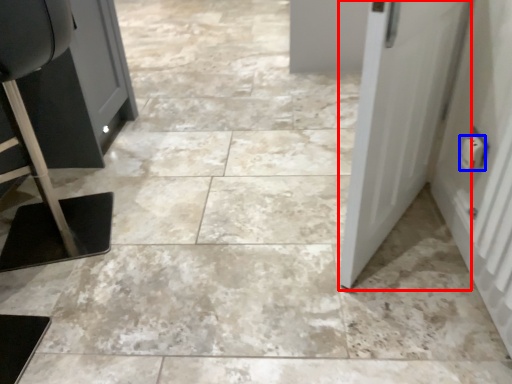
Question: Which object appears closest to the camera in this image, door (highlighted by a red box) or electric outlet (highlighted by a blue box)?

Choices:
 (A) door
 (B) electric outlet

Answer: (A)